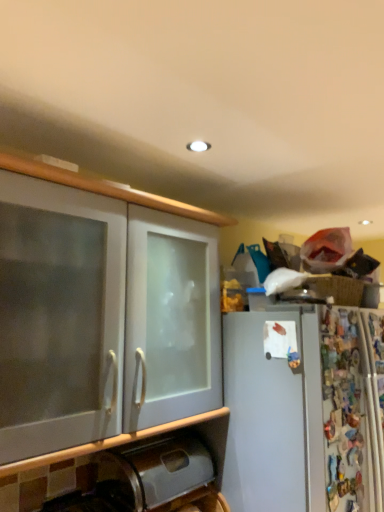
Question: Is metallic stainless steel trash can at lower left directly adjacent to white frosted glass cabinet at left?

Choices:
 (A) yes
 (B) no

Answer: (B)

Question: Does metallic stainless steel trash can at lower left appear on the left side of white frosted glass cabinet at left?

Choices:
 (A) yes
 (B) no

Answer: (B)

Question: Is the depth of metallic stainless steel trash can at lower left less than that of white frosted glass cabinet at left?

Choices:
 (A) yes
 (B) no

Answer: (B)

Question: From the image's perspective, would you say metallic stainless steel trash can at lower left is positioned over white frosted glass cabinet at left?

Choices:
 (A) yes
 (B) no

Answer: (B)

Question: From a real-world perspective, is metallic stainless steel trash can at lower left physically below white frosted glass cabinet at left?

Choices:
 (A) yes
 (B) no

Answer: (A)

Question: Would you say white frosted glass cabinet at left is part of metallic stainless steel trash can at lower left's contents?

Choices:
 (A) yes
 (B) no

Answer: (B)

Question: Considering the relative sizes of white frosted glass cabinet at left and metallic stainless steel trash can at lower left in the image provided, is white frosted glass cabinet at left smaller than metallic stainless steel trash can at lower left?

Choices:
 (A) no
 (B) yes

Answer: (A)

Question: Does white frosted glass cabinet at left have a greater width compared to metallic stainless steel trash can at lower left?

Choices:
 (A) yes
 (B) no

Answer: (A)

Question: Does white frosted glass cabinet at left have a larger size compared to metallic stainless steel trash can at lower left?

Choices:
 (A) yes
 (B) no

Answer: (A)

Question: Can you confirm if white frosted glass cabinet at left is taller than metallic stainless steel trash can at lower left?

Choices:
 (A) yes
 (B) no

Answer: (A)

Question: Is white frosted glass cabinet at left facing towards metallic stainless steel trash can at lower left?

Choices:
 (A) no
 (B) yes

Answer: (A)

Question: Is white frosted glass cabinet at left oriented away from metallic stainless steel trash can at lower left?

Choices:
 (A) no
 (B) yes

Answer: (A)

Question: From a real-world perspective, is metallic stainless steel trash can at lower left above or below white frosted glass cabinet at left?

Choices:
 (A) above
 (B) below

Answer: (B)